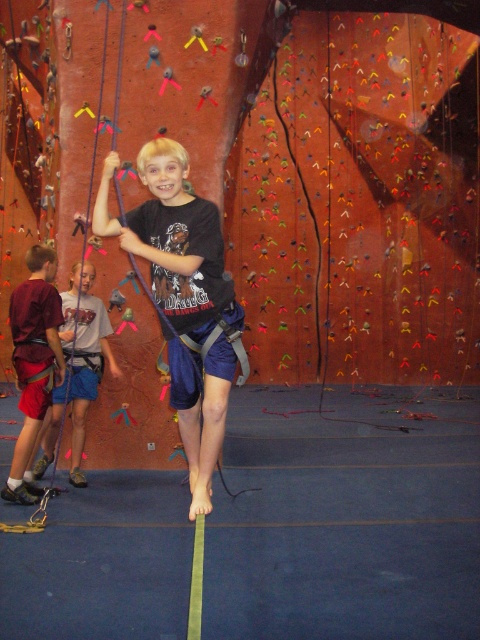
Between matte blue shorts at center and red cotton shorts at left, which one is positioned higher?

matte blue shorts at center

I want to click on matte blue shorts at center, so click(x=173, y=241).

Does point (145, 177) come farther from viewer compared to point (44, 342)?

No, (145, 177) is closer to viewer.

At what (x,y) coordinates should I click in order to perform the action: click on matte blue shorts at center. Please return your answer as a coordinate pair (x, y). Image resolution: width=480 pixels, height=640 pixels. Looking at the image, I should click on (173, 241).

Which is more to the right, red cotton shorts at left or blue fabric shorts at center?

From the viewer's perspective, blue fabric shorts at center appears more on the right side.

Is red cotton shorts at left below blue fabric shorts at center?

No.

At what (x,y) coordinates should I click in order to perform the action: click on red cotton shorts at left. Please return your answer as a coordinate pair (x, y). Looking at the image, I should click on (34, 358).

Who is shorter, matte blue shorts at center or blue fabric shorts at center?

blue fabric shorts at center is shorter.

Is matte blue shorts at center positioned before blue fabric shorts at center?

Yes, it is in front of blue fabric shorts at center.

Find the location of a particular element. The width and height of the screenshot is (480, 640). matte blue shorts at center is located at coordinates (173, 241).